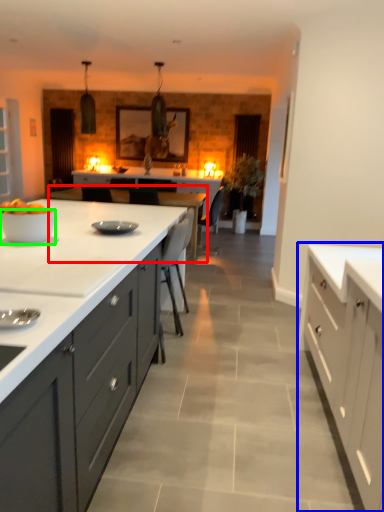
Question: Which object is the farthest from table (highlighted by a red box)? Choose among these: cabinetry (highlighted by a blue box) or bowl (highlighted by a green box).

Choices:
 (A) cabinetry
 (B) bowl

Answer: (A)